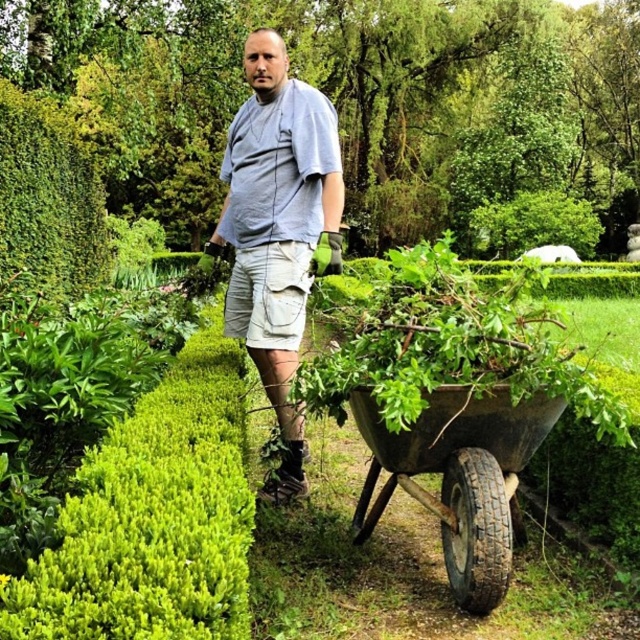
Question: Does green leafy bush at center appear under gray cotton shirt at center?

Choices:
 (A) no
 (B) yes

Answer: (B)

Question: Which object is closer to the camera taking this photo?

Choices:
 (A) green leafy bush at center
 (B) gray cotton shirt at center
 (C) rusty metal wheelbarrow at lower right

Answer: (A)

Question: Which object is the farthest from the rusty metal wheelbarrow at lower right?

Choices:
 (A) gray cotton shirt at center
 (B) green leafy bush at center

Answer: (A)

Question: Which object appears closest to the camera in this image?

Choices:
 (A) green leafy bush at center
 (B) rusty metal wheelbarrow at lower right
 (C) gray cotton shirt at center

Answer: (A)

Question: Does green leafy bush at center appear on the right side of gray cotton shirt at center?

Choices:
 (A) yes
 (B) no

Answer: (B)

Question: Can you confirm if gray cotton shirt at center is positioned to the right of rusty metal wheelbarrow at lower right?

Choices:
 (A) no
 (B) yes

Answer: (A)